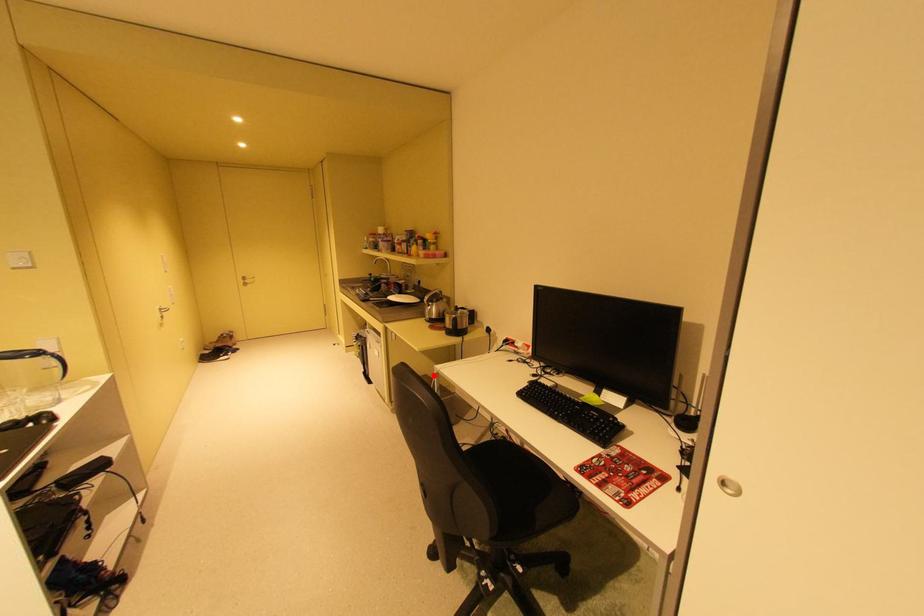
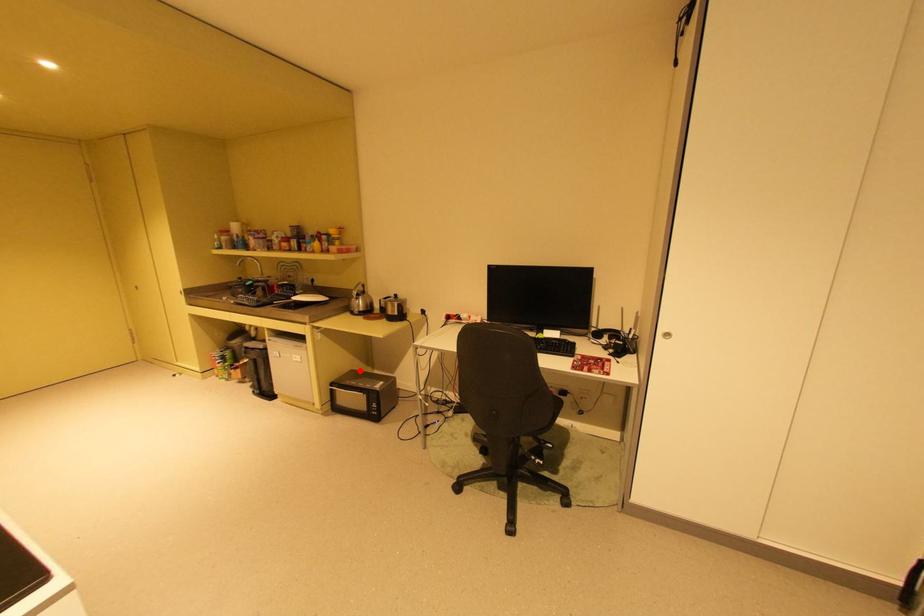
I am providing you with two images of the same scene from different viewpoints. A red point is marked on the first image and another point is marked on the second image. Is the marked point in image1 the same physical position as the marked point in image2?

Yes